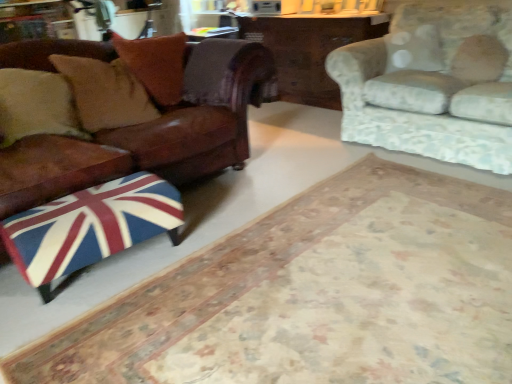
This screenshot has width=512, height=384. What are the coordinates of `empty space that is in between leather couch at left, the first studio couch when ordered from left to right, and union jack fabric ottoman at lower left` in the screenshot? It's located at (206, 214).